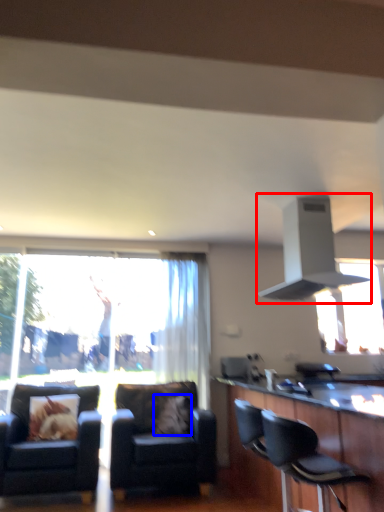
Question: Which object is closer to the camera taking this photo, exhaust hood (highlighted by a red box) or pillow (highlighted by a blue box)?

Choices:
 (A) exhaust hood
 (B) pillow

Answer: (A)